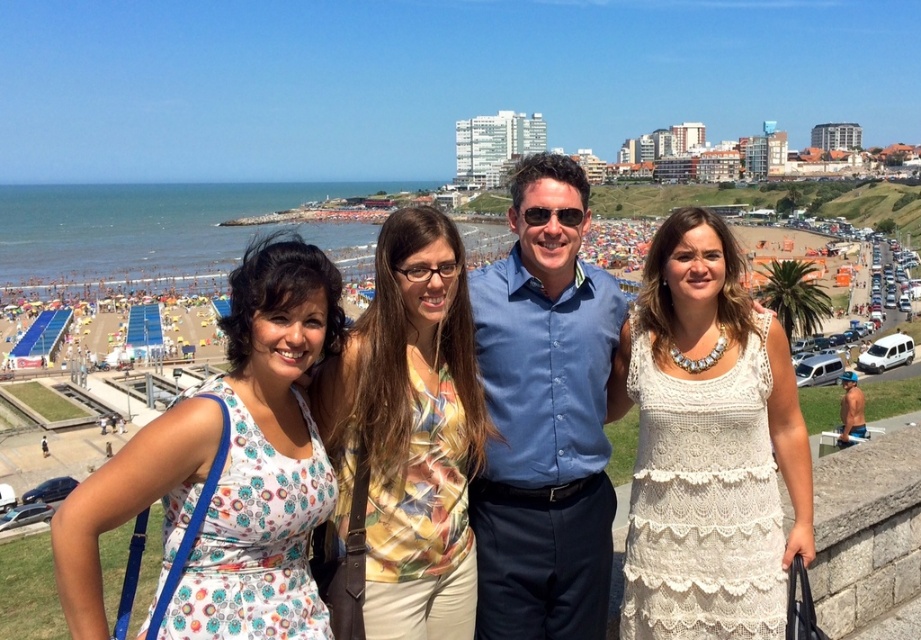
Question: Where is blue button-down shirt at center located in relation to printed fabric blouse at center in the image?

Choices:
 (A) left
 (B) right

Answer: (B)

Question: Does white floral dress at left come in front of tan skin man at center?

Choices:
 (A) no
 (B) yes

Answer: (B)

Question: Considering the relative positions of blue button-down shirt at center and printed fabric blouse at center in the image provided, where is blue button-down shirt at center located with respect to printed fabric blouse at center?

Choices:
 (A) below
 (B) above

Answer: (B)

Question: Estimate the real-world distances between objects in this image. Which object is farther from the white floral dress at left?

Choices:
 (A) printed fabric blouse at center
 (B) white lace dress at center
 (C) tan skin man at center

Answer: (C)

Question: Among these points, which one is farthest from the camera?

Choices:
 (A) (742, 355)
 (B) (426, 337)

Answer: (B)

Question: Estimate the real-world distances between objects in this image. Which object is closer to the white lace dress at center?

Choices:
 (A) blue button-down shirt at center
 (B) tan skin man at center
 (C) printed fabric blouse at center
 (D) white floral dress at left

Answer: (A)